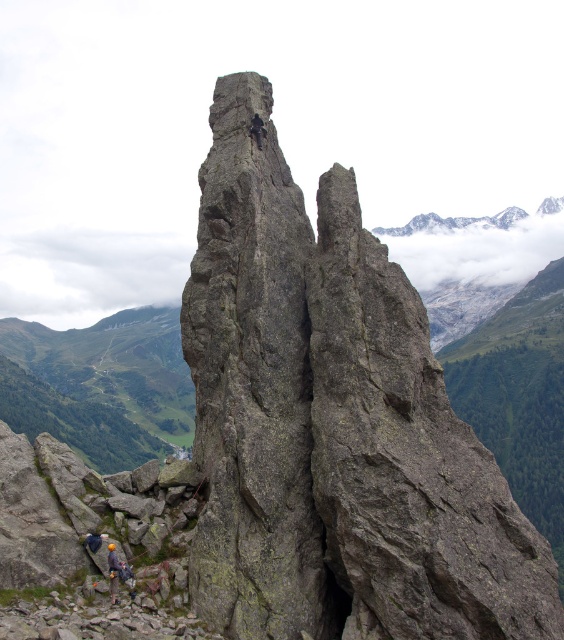
Question: Which object is farther from the camera taking this photo?

Choices:
 (A) gray rough rock at center
 (B) orange helmeted climber at lower left

Answer: (B)

Question: Can you confirm if gray rough rock at center is positioned to the left of orange helmeted climber at lower left?

Choices:
 (A) yes
 (B) no

Answer: (B)

Question: Is gray rough rock at center bigger than orange helmeted climber at lower left?

Choices:
 (A) yes
 (B) no

Answer: (A)

Question: In this image, where is gray rough rock at center located relative to orange helmeted climber at lower left?

Choices:
 (A) right
 (B) left

Answer: (A)